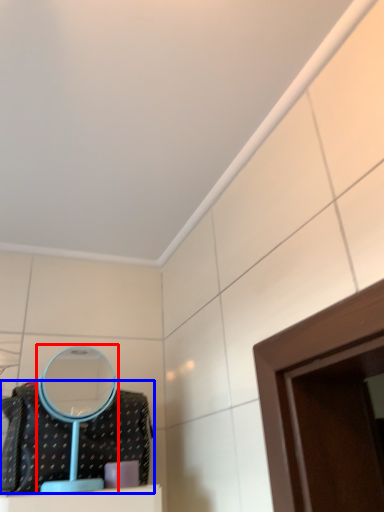
Question: Which object appears farthest to the camera in this image, mirror (highlighted by a red box) or clothing (highlighted by a blue box)?

Choices:
 (A) mirror
 (B) clothing

Answer: (A)